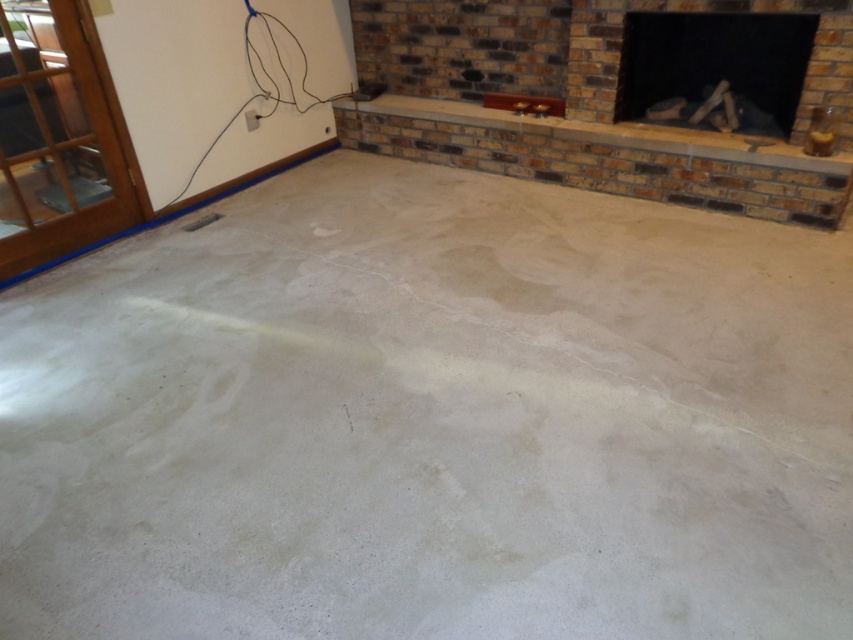
Which of these two, brick fireplace at upper center or black brick fireplace at upper right, stands shorter?

black brick fireplace at upper right

You are a GUI agent. You are given a task and a screenshot of the screen. Output one action in this format:
    pyautogui.click(x=<x>, y=<y>)
    Task: Click on the brick fireplace at upper center
    The image size is (853, 640).
    Given the screenshot: What is the action you would take?
    pyautogui.click(x=566, y=108)